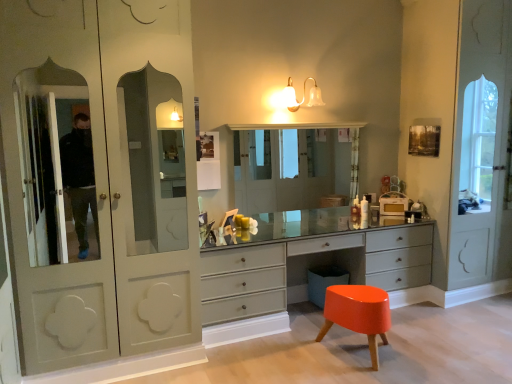
Question: Is clear glass medicine cabinet at center inside orange glossy stool at lower right?

Choices:
 (A) no
 (B) yes

Answer: (A)

Question: From a real-world perspective, is orange glossy stool at lower right positioned under clear glass medicine cabinet at center based on gravity?

Choices:
 (A) no
 (B) yes

Answer: (B)

Question: From a real-world perspective, is orange glossy stool at lower right on top of clear glass medicine cabinet at center?

Choices:
 (A) yes
 (B) no

Answer: (B)

Question: Considering the relative sizes of orange glossy stool at lower right and clear glass medicine cabinet at center in the image provided, is orange glossy stool at lower right wider than clear glass medicine cabinet at center?

Choices:
 (A) yes
 (B) no

Answer: (A)

Question: Could you tell me if orange glossy stool at lower right is turned towards clear glass medicine cabinet at center?

Choices:
 (A) yes
 (B) no

Answer: (B)

Question: From the image's perspective, is satin gray dresser at center positioned above or below matte white wardrobe at left?

Choices:
 (A) above
 (B) below

Answer: (B)

Question: Is satin gray dresser at center to the left or to the right of matte white wardrobe at left in the image?

Choices:
 (A) left
 (B) right

Answer: (B)

Question: Considering the positions of satin gray dresser at center and matte white wardrobe at left in the image, is satin gray dresser at center bigger or smaller than matte white wardrobe at left?

Choices:
 (A) big
 (B) small

Answer: (B)

Question: Is satin gray dresser at center in front of or behind matte white wardrobe at left in the image?

Choices:
 (A) behind
 (B) front

Answer: (A)

Question: From the image's perspective, is satin gray dresser at center above or below clear glass medicine cabinet at center?

Choices:
 (A) above
 (B) below

Answer: (B)

Question: Considering their positions, is satin gray dresser at center located in front of or behind clear glass medicine cabinet at center?

Choices:
 (A) front
 (B) behind

Answer: (A)

Question: Is point (232, 306) positioned closer to the camera than point (253, 190)?

Choices:
 (A) farther
 (B) closer

Answer: (B)

Question: Is satin gray dresser at center inside or outside of clear glass medicine cabinet at center?

Choices:
 (A) inside
 (B) outside

Answer: (B)

Question: In the image, is clear glass medicine cabinet at center positioned in front of or behind satin gray dresser at center?

Choices:
 (A) behind
 (B) front

Answer: (A)

Question: Considering the relative positions of clear glass medicine cabinet at center and satin gray dresser at center in the image provided, is clear glass medicine cabinet at center to the left or to the right of satin gray dresser at center?

Choices:
 (A) right
 (B) left

Answer: (B)